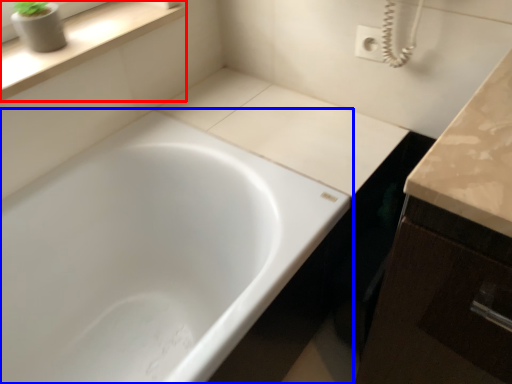
Question: Which of the following is the closest to the observer, window sill (highlighted by a red box) or bathtub (highlighted by a blue box)?

Choices:
 (A) window sill
 (B) bathtub

Answer: (B)